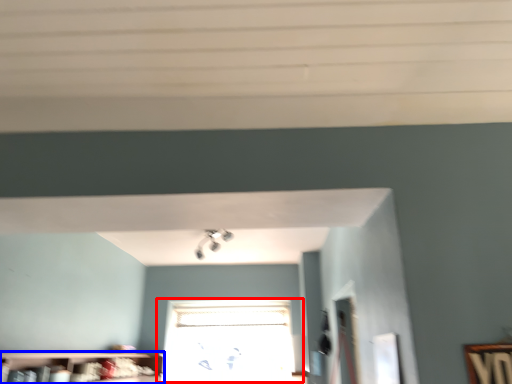
Question: Which object appears farthest to the camera in this image, window (highlighted by a red box) or shelf (highlighted by a blue box)?

Choices:
 (A) window
 (B) shelf

Answer: (A)